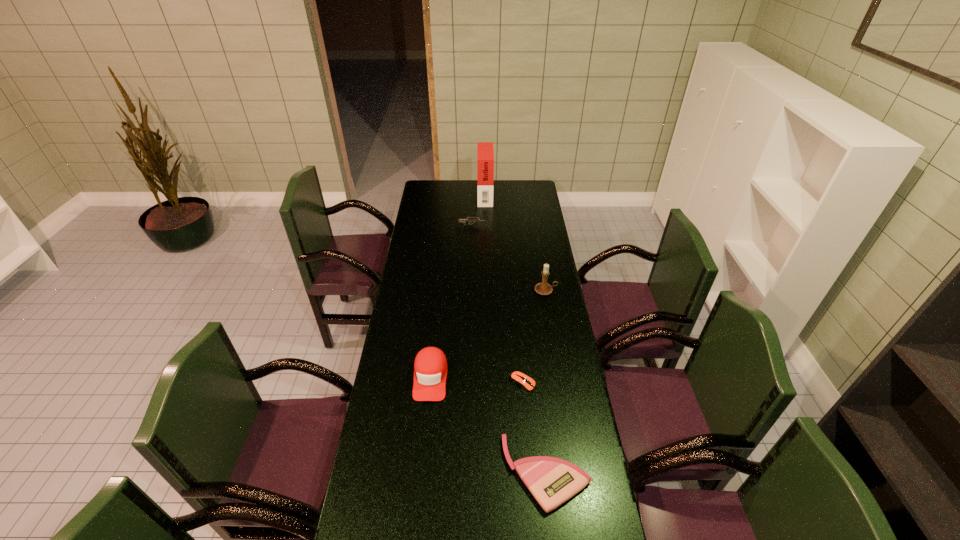
The image size is (960, 540). In order to click on vacant space located on the front-facing side of the farthest object in this screenshot , I will do `click(436, 194)`.

Where is `vacant space located on the front-facing side of the farthest object`? The image size is (960, 540). vacant space located on the front-facing side of the farthest object is located at coordinates pos(451,194).

Identify the location of free space located 0.150m on the front-facing side of the farthest object. (452, 194).

The image size is (960, 540). Identify the location of free space located on the front-facing side of the baseball cap. (419, 495).

The image size is (960, 540). In order to click on free space located aimed along the barrel of the fifth nearest object in this screenshot , I will do `click(498, 225)`.

Locate an element on the screen. This screenshot has height=540, width=960. vacant space situated on the left of the nearest object is located at coordinates (404, 472).

Identify the location of vacant space located 0.150m on the front of the shortest object. (527, 430).

Identify the location of object located at the far edge. The image size is (960, 540). (485, 154).

Where is `object that is at the left edge`? This screenshot has height=540, width=960. object that is at the left edge is located at coordinates (430, 367).

This screenshot has height=540, width=960. I want to click on candle holder that is at the right edge, so click(544, 288).